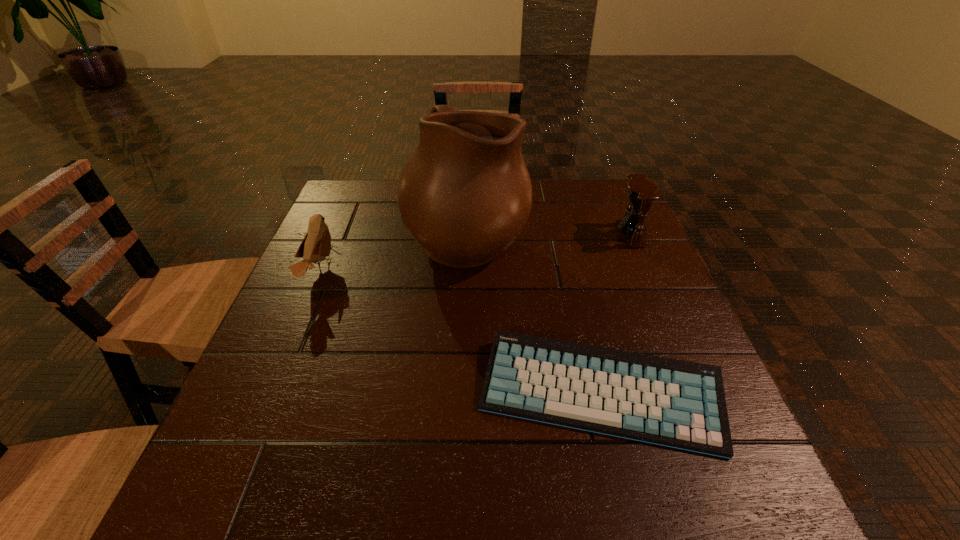
The height and width of the screenshot is (540, 960). In order to click on cream pitcher that is at the far edge in this screenshot , I will do `click(465, 195)`.

Locate an element on the screen. hourglass that is at the far edge is located at coordinates (641, 192).

This screenshot has height=540, width=960. I want to click on object positioned at the left edge, so click(316, 246).

This screenshot has width=960, height=540. In order to click on hourglass that is at the right edge in this screenshot , I will do `click(641, 192)`.

You are a GUI agent. You are given a task and a screenshot of the screen. Output one action in this format:
    pyautogui.click(x=<x>, y=<y>)
    Task: Click on the computer keyboard located in the right edge section of the desktop
    
    Given the screenshot: What is the action you would take?
    point(681,404)

Locate an element on the screen. object located in the far right corner section of the desktop is located at coordinates (641, 192).

In the image, there is a desktop. Where is `vacant space at the far edge`? The image size is (960, 540). vacant space at the far edge is located at coordinates (540, 207).

At what (x,y) coordinates should I click in order to perform the action: click on free space at the near edge. Please return your answer as a coordinate pair (x, y). The width and height of the screenshot is (960, 540). Looking at the image, I should click on (624, 515).

Locate an element on the screen. The image size is (960, 540). vacant space at the left edge is located at coordinates (345, 302).

Where is `vacant point at the right edge`? The width and height of the screenshot is (960, 540). vacant point at the right edge is located at coordinates (664, 274).